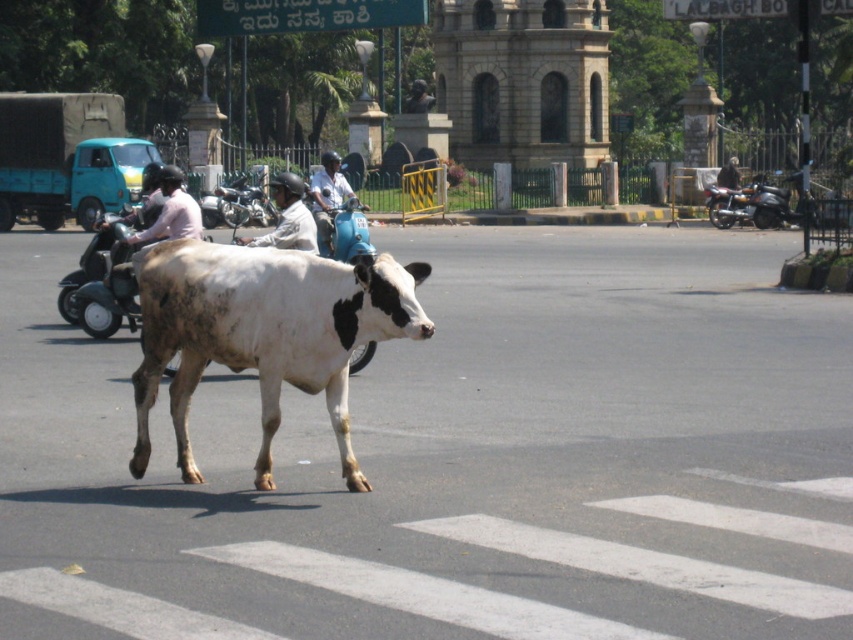
Is white matte helmet at center shorter than light blue helmet at center?

Indeed, white matte helmet at center has a lesser height compared to light blue helmet at center.

Between white matte helmet at center and light blue helmet at center, which one is positioned lower?

white matte helmet at center is lower down.

What do you see at coordinates (288, 218) in the screenshot?
I see `white matte helmet at center` at bounding box center [288, 218].

Locate an element on the screen. The width and height of the screenshot is (853, 640). white matte helmet at center is located at coordinates click(288, 218).

Does light blue helmet at center appear on the left side of light brown leather helmet at center?

Correct, you'll find light blue helmet at center to the left of light brown leather helmet at center.

Does light blue helmet at center have a lesser height compared to light brown leather helmet at center?

Incorrect, light blue helmet at center's height does not fall short of light brown leather helmet at center's.

This screenshot has height=640, width=853. Describe the element at coordinates (328, 193) in the screenshot. I see `light blue helmet at center` at that location.

This screenshot has height=640, width=853. Identify the location of light blue helmet at center. (328, 193).

Is the position of metallic blue scooter at left more distant than that of light brown leather helmet at center?

No.

Can you confirm if metallic blue scooter at left is bigger than light brown leather helmet at center?

Yes, metallic blue scooter at left is bigger than light brown leather helmet at center.

This screenshot has height=640, width=853. What are the coordinates of `metallic blue scooter at left` in the screenshot? It's located at click(x=97, y=280).